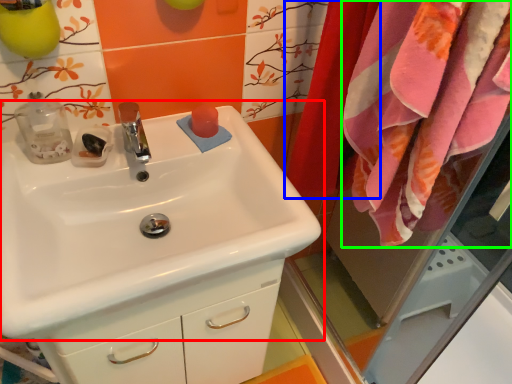
Question: Which object is positioned farthest from sink (highlighted by a red box)? Select from curtain (highlighted by a blue box) and bath towel (highlighted by a green box).

Choices:
 (A) curtain
 (B) bath towel

Answer: (A)